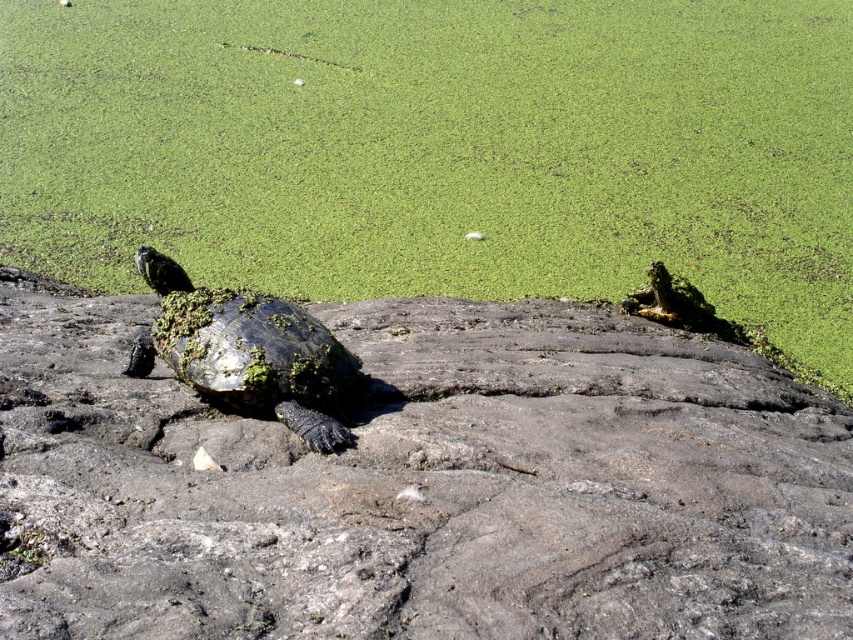
You are a biologist observing the turtle habitat. You notice the rough textured rock at center and the green mossy algae at upper left. Which object is positioned higher in the image?

The green mossy algae at upper left is positioned higher in the image than the rough textured rock at center.

You are standing at the edge of the water covered with green algae and looking towards the turtle resting on the rocky surface. There is a point at coordinates point (421,484). What is located at that point?

The point (421,484) corresponds to rough textured rock at center.

You are a biologist observing the scene. You need to determine which object occupies more horizontal space in the image. Which one has a greater width between the green mossy algae at upper left and the green mossy tortoise at center?

The green mossy algae at upper left has a greater width than the green mossy tortoise at center according to the description.